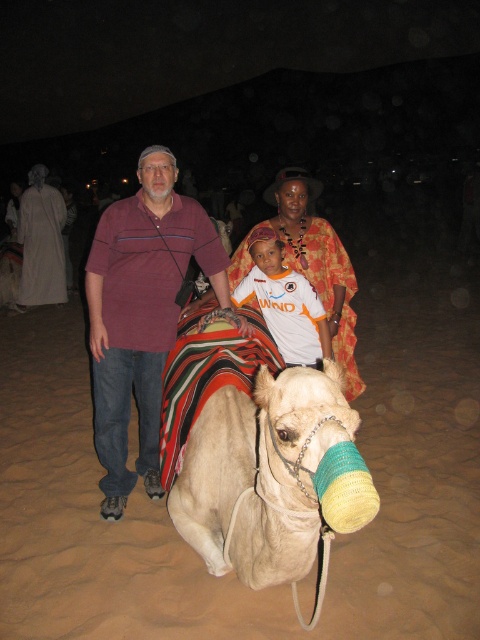
Question: Does white sand at lower center appear on the left side of white cotton robe at left?

Choices:
 (A) yes
 (B) no

Answer: (B)

Question: Which point appears farthest from the camera in this image?

Choices:
 (A) (x=116, y=300)
 (B) (x=300, y=508)
 (C) (x=61, y=273)
 (D) (x=391, y=456)

Answer: (C)

Question: In this image, where is maroon cotton shirt at center located relative to white cotton robe at left?

Choices:
 (A) left
 (B) right

Answer: (B)

Question: Which of the following is the closest to the observer?

Choices:
 (A) (133, 276)
 (B) (238, 612)

Answer: (B)

Question: Which of the following is the closest to the observer?

Choices:
 (A) (41, 188)
 (B) (275, 529)
 (C) (409, 312)
 (D) (117, 316)

Answer: (B)

Question: Is light beige fabric camel at center closer to the viewer compared to white cotton robe at left?

Choices:
 (A) yes
 (B) no

Answer: (A)